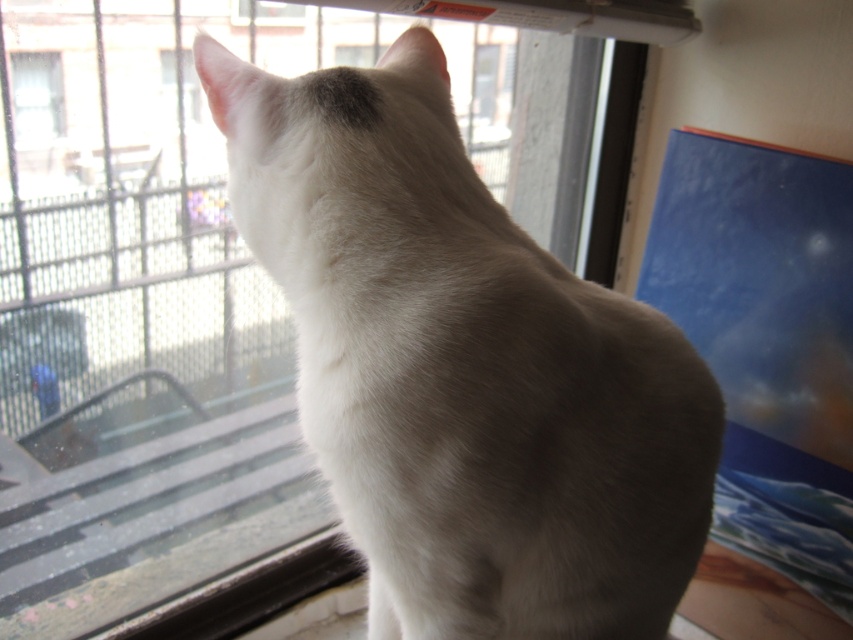
Question: Is white fur cat at center above transparent glass window at upper left?

Choices:
 (A) yes
 (B) no

Answer: (B)

Question: Which point is farther to the camera?

Choices:
 (A) (42, 67)
 (B) (520, 337)

Answer: (A)

Question: Which object is farther from the camera taking this photo?

Choices:
 (A) transparent glass window at upper left
 (B) white fur cat at center

Answer: (A)

Question: Among these objects, which one is farthest from the camera?

Choices:
 (A) transparent glass window at upper left
 (B) white fur cat at center

Answer: (A)

Question: Does white fur cat at center come in front of transparent glass window at upper left?

Choices:
 (A) no
 (B) yes

Answer: (B)

Question: Can you confirm if white fur cat at center is thinner than transparent glass window at upper left?

Choices:
 (A) no
 (B) yes

Answer: (A)